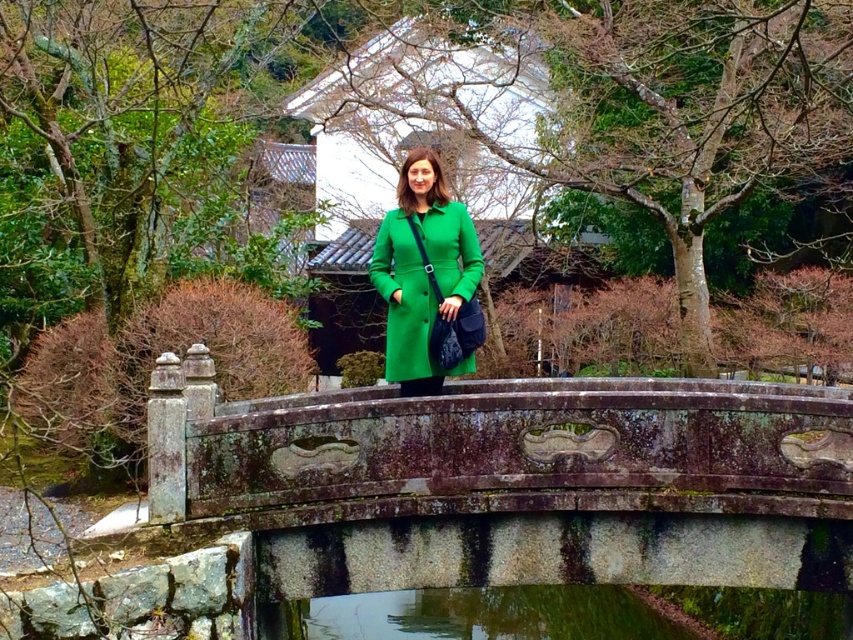
Does rusty stone bridge at center appear under clear water at bridge center?

No.

Which is behind, point (299, 433) or point (669, 628)?

Positioned behind is point (669, 628).

Identify the location of rusty stone bridge at center. The width and height of the screenshot is (853, 640). coord(518,483).

Can you confirm if rusty stone bridge at center is positioned below green matte coat at center?

Correct, rusty stone bridge at center is located below green matte coat at center.

Find the location of `rusty stone bridge at center`. rusty stone bridge at center is located at coordinates (518, 483).

Who is more distant from viewer, (680, 634) or (392, 248)?

The point (680, 634) is more distant.

Does point (534, 618) lie in front of point (428, 166)?

No, (534, 618) is further to viewer.

Where is `clear water at bridge center`? This screenshot has height=640, width=853. clear water at bridge center is located at coordinates (491, 614).

At what (x,y) coordinates should I click in order to perform the action: click on clear water at bridge center. Please return your answer as a coordinate pair (x, y). Looking at the image, I should click on (491, 614).